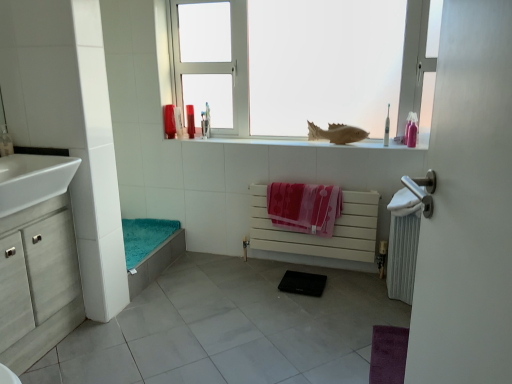
You are a GUI agent. You are given a task and a screenshot of the screen. Output one action in this format:
    pyautogui.click(x=<x>, y=<y>)
    Task: Click on the vacant area situated to the left side of white metallic radiator at right, which is counted as the 1th radiator, starting from the right
    This screenshot has height=384, width=512.
    Given the screenshot: What is the action you would take?
    pyautogui.click(x=361, y=288)